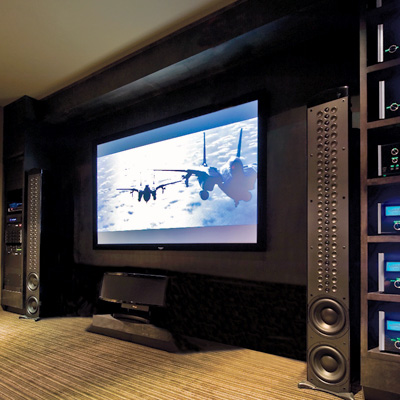
I want to click on speaker cone, so click(328, 361), click(328, 317), click(30, 303), click(32, 278).